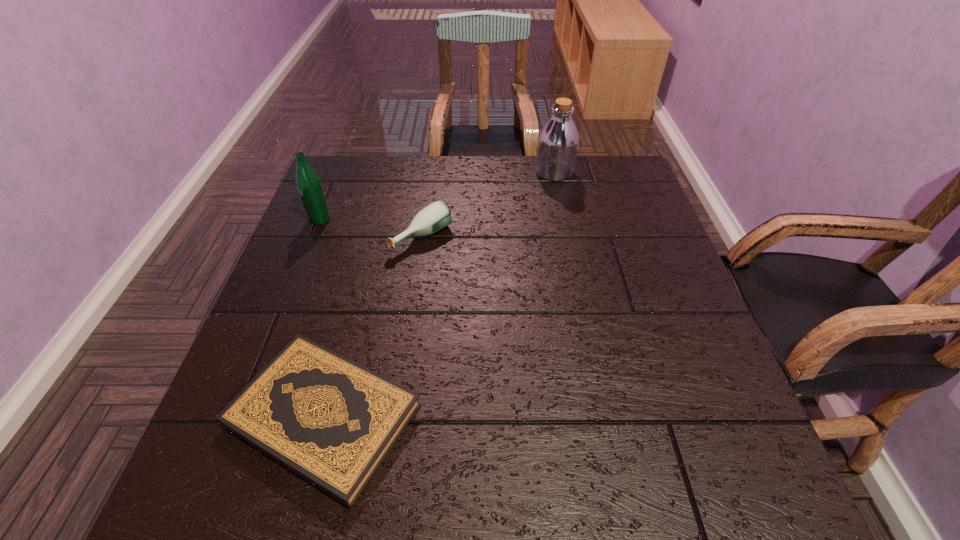
Where is `vacant space at the far right corner of the desktop`? This screenshot has width=960, height=540. vacant space at the far right corner of the desktop is located at coordinates (576, 166).

The width and height of the screenshot is (960, 540). I want to click on vacant area at the near right corner of the desktop, so click(785, 511).

I want to click on vacant space that's between the farthest object and the leftmost bottle, so click(x=437, y=195).

I want to click on unoccupied area between the nearest object and the leftmost bottle, so click(x=322, y=318).

Find the location of a particular element. Image resolution: width=960 pixels, height=540 pixels. unoccupied area between the farthest object and the shortest object is located at coordinates (439, 294).

Locate an element on the screen. This screenshot has width=960, height=540. empty space between the nearest object and the leftmost bottle is located at coordinates [x=322, y=318].

I want to click on vacant region between the farthest object and the second bottle from right to left, so click(488, 204).

In order to click on empty space that is in between the leftmost bottle and the farthest bottle in this screenshot , I will do `click(437, 195)`.

Image resolution: width=960 pixels, height=540 pixels. Identify the location of free area in between the rightmost object and the nearest object. pyautogui.click(x=439, y=294).

This screenshot has height=540, width=960. Find the location of `free space between the farthest bottle and the nearest object`. free space between the farthest bottle and the nearest object is located at coordinates (439, 294).